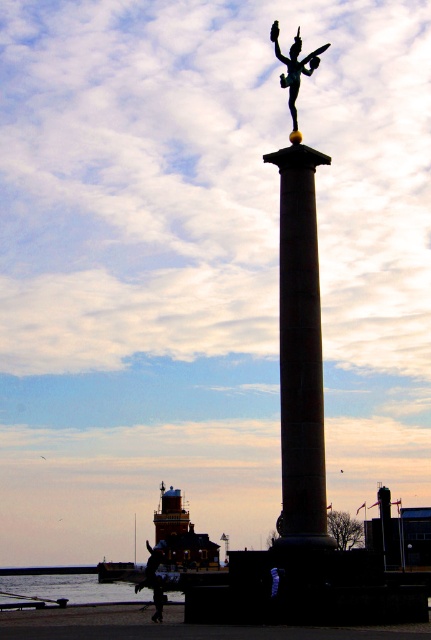
Can you confirm if bronze column at center is smaller than silvery metallic statue at upper center?

Actually, bronze column at center might be larger than silvery metallic statue at upper center.

Is bronze column at center taller than silvery metallic statue at upper center?

Correct, bronze column at center is much taller as silvery metallic statue at upper center.

You are a GUI agent. You are given a task and a screenshot of the screen. Output one action in this format:
    pyautogui.click(x=<x>, y=<y>)
    Task: Click on the bronze column at center
    The image size is (431, 640).
    Given the screenshot: What is the action you would take?
    pyautogui.click(x=299, y=352)

Is transparent water at lower left wider than dark skin smooth person at lower center?

Indeed, transparent water at lower left has a greater width compared to dark skin smooth person at lower center.

Does point (86, 577) come closer to viewer compared to point (156, 579)?

No, (86, 577) is behind (156, 579).

I want to click on transparent water at lower left, so click(x=72, y=588).

Which is more to the right, bronze column at center or transparent water at lower left?

bronze column at center is more to the right.

You are a GUI agent. You are given a task and a screenshot of the screen. Output one action in this format:
    pyautogui.click(x=<x>, y=<y>)
    Task: Click on the bronze column at center
    The height and width of the screenshot is (640, 431).
    Given the screenshot: What is the action you would take?
    pyautogui.click(x=299, y=352)

Find the location of a particular element. bronze column at center is located at coordinates (299, 352).